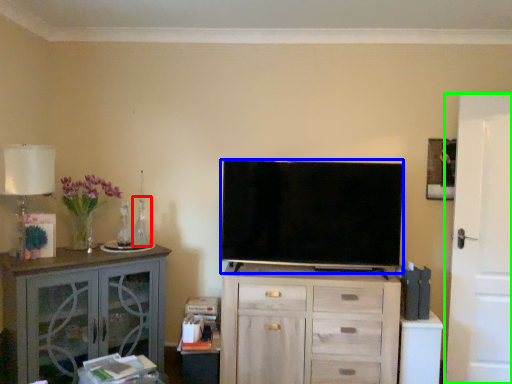
Question: Considering the real-world distances, which object is closest to vase (highlighted by a red box)? television (highlighted by a blue box) or door (highlighted by a green box).

Choices:
 (A) television
 (B) door

Answer: (A)